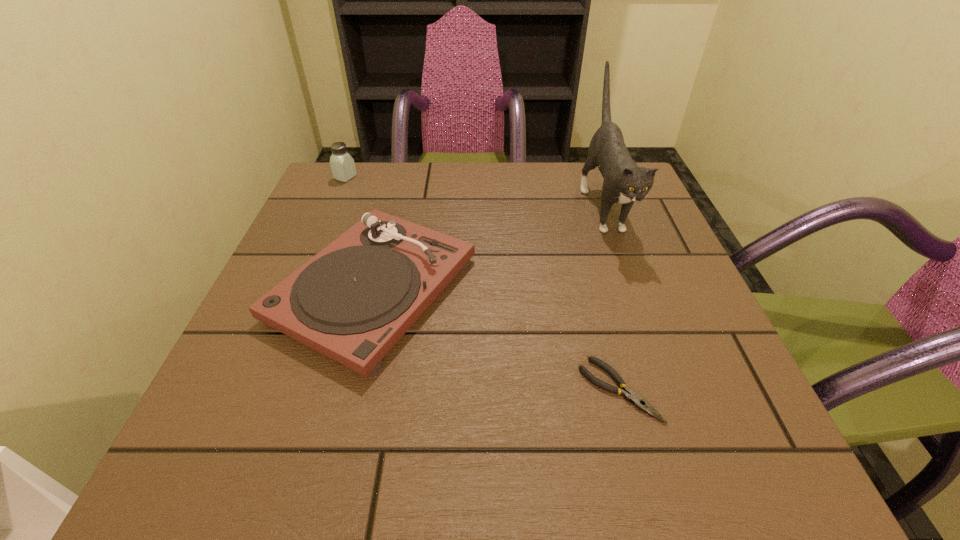
You are a GUI agent. You are given a task and a screenshot of the screen. Output one action in this format:
    pyautogui.click(x=<x>, y=<y>)
    Task: Click on the tallest object
    The image size is (960, 540).
    Given the screenshot: What is the action you would take?
    pyautogui.click(x=624, y=182)

The image size is (960, 540). Find the location of `saltshaker`. saltshaker is located at coordinates (342, 164).

Image resolution: width=960 pixels, height=540 pixels. I want to click on phonograph_record, so click(x=353, y=301).

Find the location of a particular element. pliers is located at coordinates (629, 395).

The width and height of the screenshot is (960, 540). In order to click on free space located 0.380m at the face of the cat in this screenshot , I will do `click(686, 435)`.

You are a GUI agent. You are given a task and a screenshot of the screen. Output one action in this format:
    pyautogui.click(x=<x>, y=<y>)
    Task: Click on the vacant space situated on the right of the saltshaker
    The width and height of the screenshot is (960, 540).
    Given the screenshot: What is the action you would take?
    pyautogui.click(x=376, y=177)

You are a GUI agent. You are given a task and a screenshot of the screen. Output one action in this format:
    pyautogui.click(x=<x>, y=<y>)
    Task: Click on the vacant space located 0.120m on the back of the phonograph_record
    The height and width of the screenshot is (540, 960).
    Given the screenshot: What is the action you would take?
    pyautogui.click(x=397, y=194)

The image size is (960, 540). I want to click on free region located on the left of the shortest object, so click(357, 390).

What are the coordinates of `cat that is positioned at the far edge` in the screenshot? It's located at (624, 182).

Locate an element on the screen. saltshaker that is at the far edge is located at coordinates (342, 164).